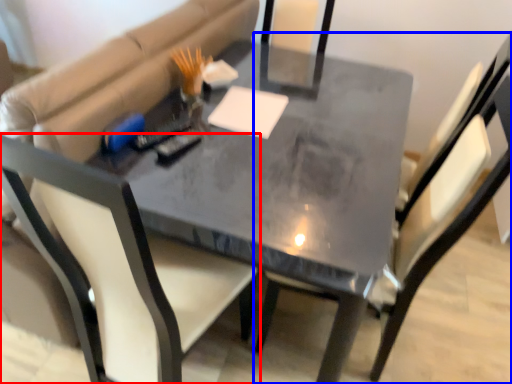
Question: Which object is closer to the camera taking this photo, chair (highlighted by a red box) or chair (highlighted by a blue box)?

Choices:
 (A) chair
 (B) chair

Answer: (B)